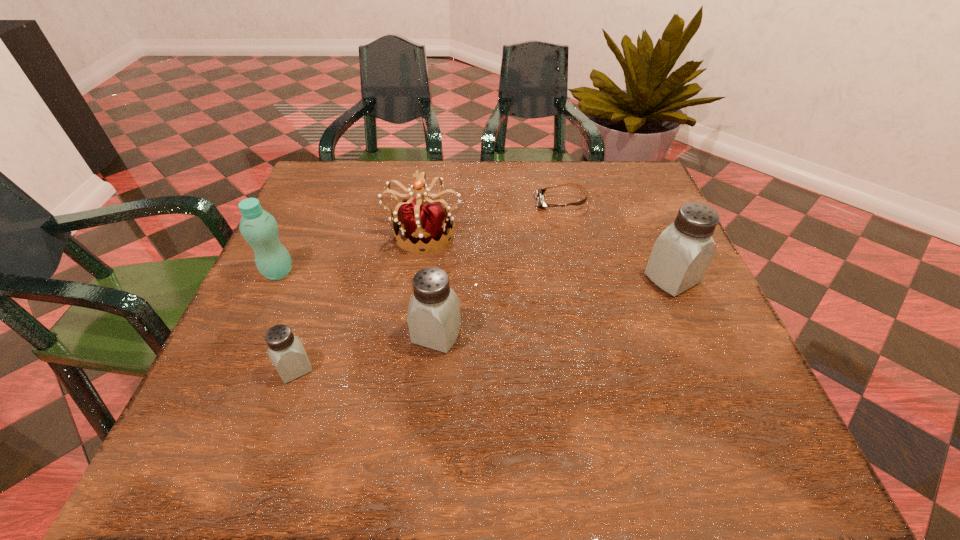
At what (x,y) coordinates should I click in order to perform the action: click on the fifth object from right to left. Please return your answer as a coordinate pair (x, y). Looking at the image, I should click on (285, 350).

Find the location of a particular element. The height and width of the screenshot is (540, 960). the fifth tallest object is located at coordinates (285, 350).

The width and height of the screenshot is (960, 540). Find the location of `the second shortest saltshaker`. the second shortest saltshaker is located at coordinates (434, 319).

This screenshot has height=540, width=960. I want to click on the rightmost object, so click(x=682, y=254).

Locate an element on the screen. The height and width of the screenshot is (540, 960). the farthest saltshaker is located at coordinates (682, 254).

Where is `the fifth object from left to right`? the fifth object from left to right is located at coordinates 539,192.

This screenshot has height=540, width=960. What are the coordinates of `the shortest object` in the screenshot? It's located at (539, 192).

You are a GUI agent. You are given a task and a screenshot of the screen. Output one action in this format:
    pyautogui.click(x=<x>, y=<y>)
    Task: Click on the bottle
    This screenshot has height=540, width=960.
    Given the screenshot: What is the action you would take?
    pyautogui.click(x=259, y=228)

Find the location of a particular element. This screenshot has width=960, height=540. tiara is located at coordinates (427, 223).

You are a GUI agent. You are given a task and a screenshot of the screen. Output one action in this format:
    pyautogui.click(x=<x>, y=<y>)
    Task: Click on the vacant space located 0.230m on the right of the leftmost saltshaker
    The height and width of the screenshot is (540, 960).
    Given the screenshot: What is the action you would take?
    pyautogui.click(x=444, y=368)